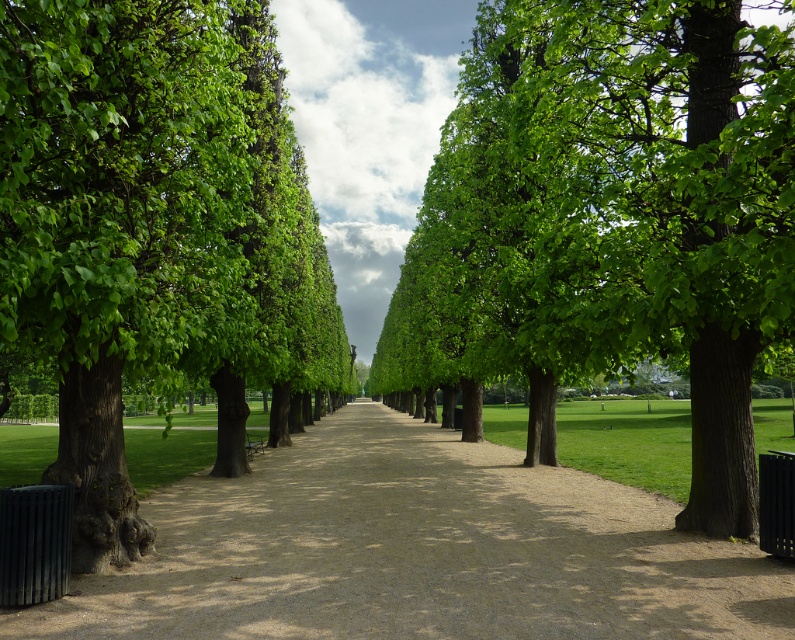
You are a park visitor standing on the pathway and want to find the tallest tree between the green leafy tree at center and the green leafy tree at left. Which tree should you look at?

The green leafy tree at center is taller than the green leafy tree at left, so you should look at the green leafy tree at center to find the tallest one.

You are standing at the entrance of the park and want to walk to the grassy area on the right side. Which direction should you head towards along the brown gravel path at center?

A: You should head towards the right side along the brown gravel path at center since the pathway meets the grassy area on the right side in the distance.